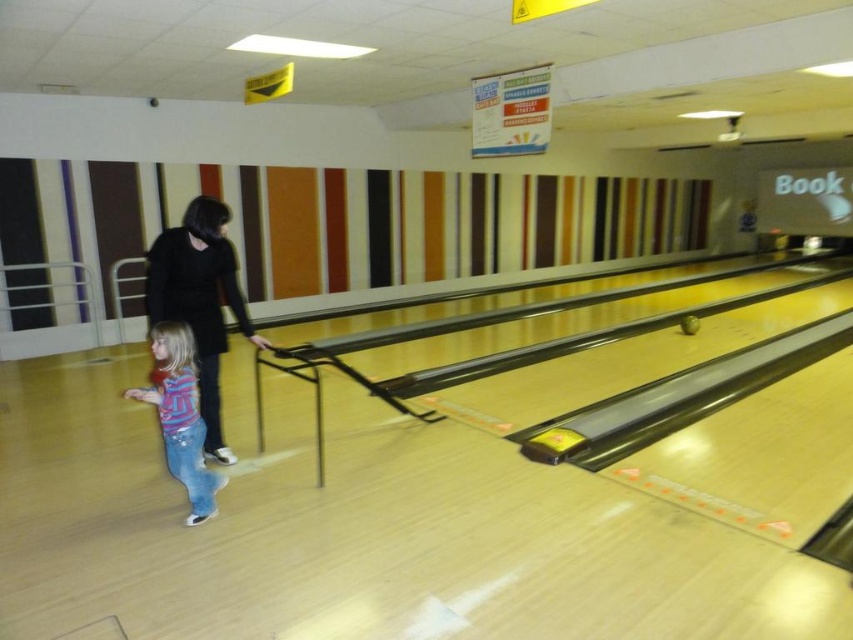
You are a customer at the bowling alley and see the black matte dress at center and the striped cotton shirt at lower left. Which clothing item is positioned higher in the image?

The black matte dress at center is located above the striped cotton shirt at lower left, so it is positioned higher in the image.

You are a customer at the bowling alley and want to know which clothing item is taller between the black matte dress at center and the striped cotton shirt at lower left. Can you tell me?

The black matte dress at center is taller than the striped cotton shirt at lower left.